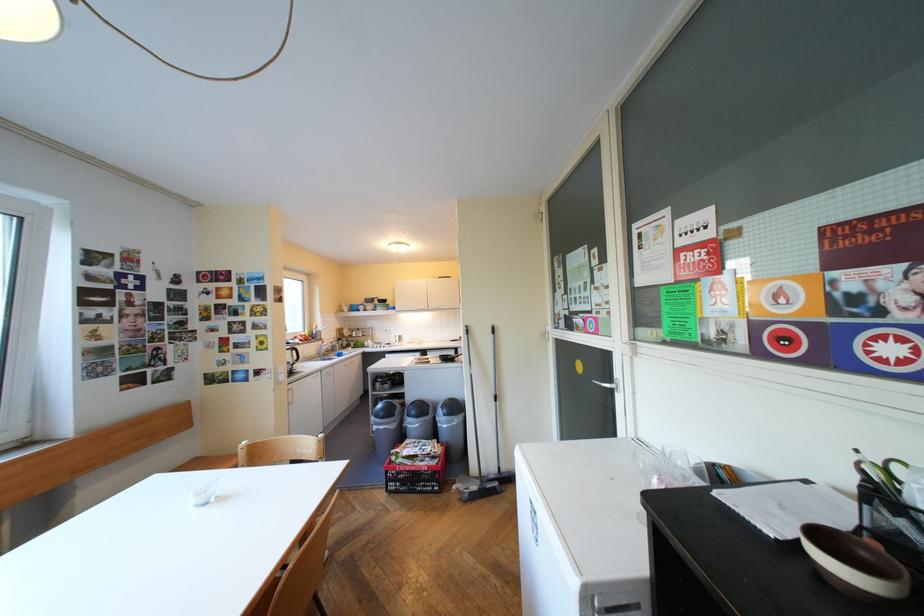
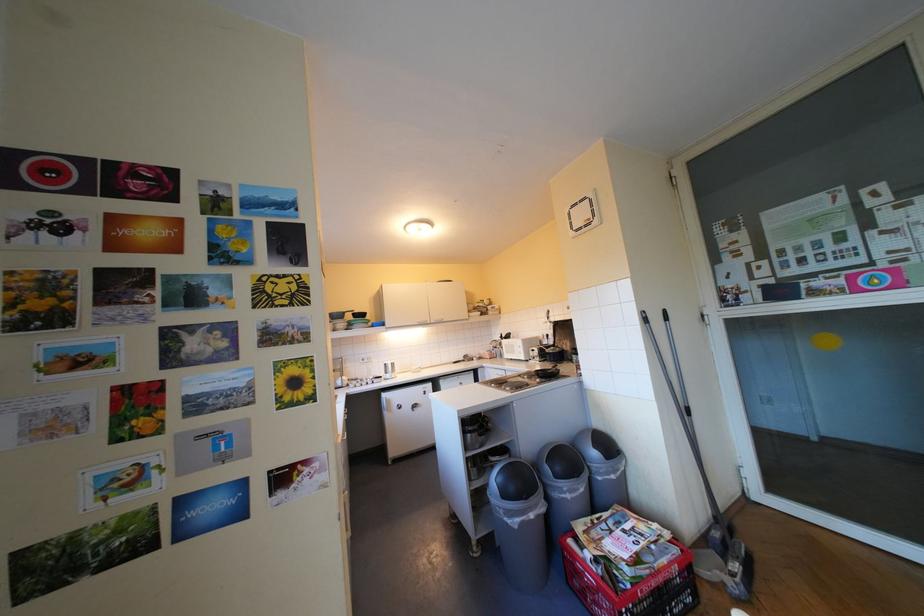
Which direction would the cameraman need to move to produce the second image?

The cameraman walked toward left, forward.